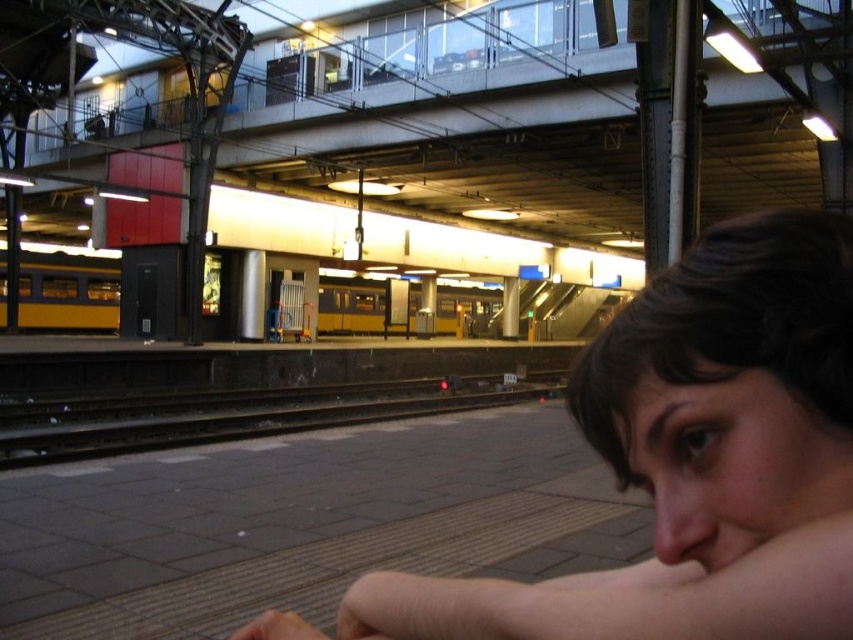
You are a passenger waiting on the platform and see the black metal train track at center and the yellow matte train at center. Which object is closer to you?

The black metal train track at center is closer to the viewer than the yellow matte train at center.